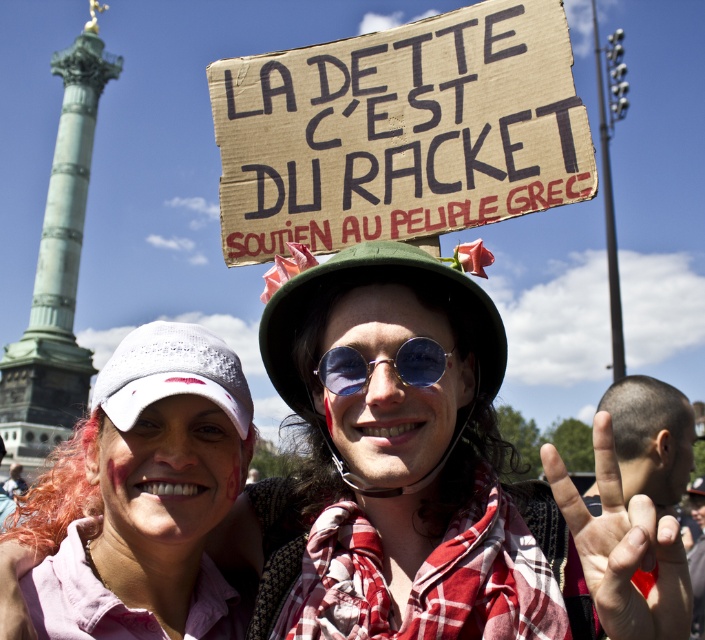
Question: Which is nearer to the pink fabric shirt at center?

Choices:
 (A) blue reflective sunglasses at center
 (B) brown cardboard sign at upper center

Answer: (B)

Question: Which object appears farthest from the camera in this image?

Choices:
 (A) matte pink shirt at center
 (B) blue reflective sunglasses at center
 (C) pink fabric shirt at center
 (D) brown cardboard sign at upper center

Answer: (C)

Question: Is brown cardboard sign at upper center positioned in front of pink fabric shirt at center?

Choices:
 (A) no
 (B) yes

Answer: (B)

Question: Observing the image, what is the correct spatial positioning of matte pink shirt at center in reference to blue reflective sunglasses at center?

Choices:
 (A) right
 (B) left

Answer: (A)

Question: In this image, where is matte pink shirt at center located relative to pink fabric shirt at center?

Choices:
 (A) above
 (B) below

Answer: (A)

Question: Which point is farther from the camera taking this photo?

Choices:
 (A) (78, 467)
 (B) (376, 246)

Answer: (A)